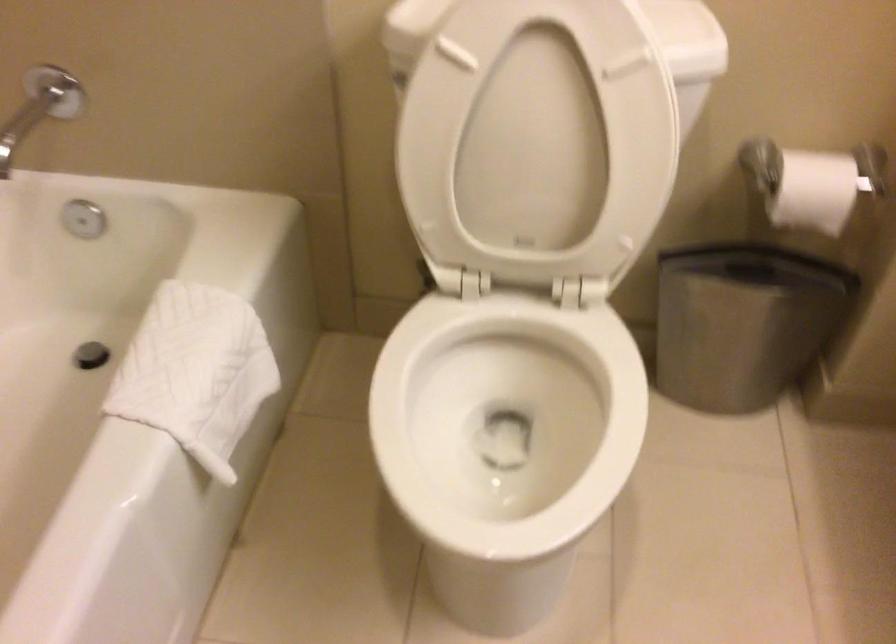
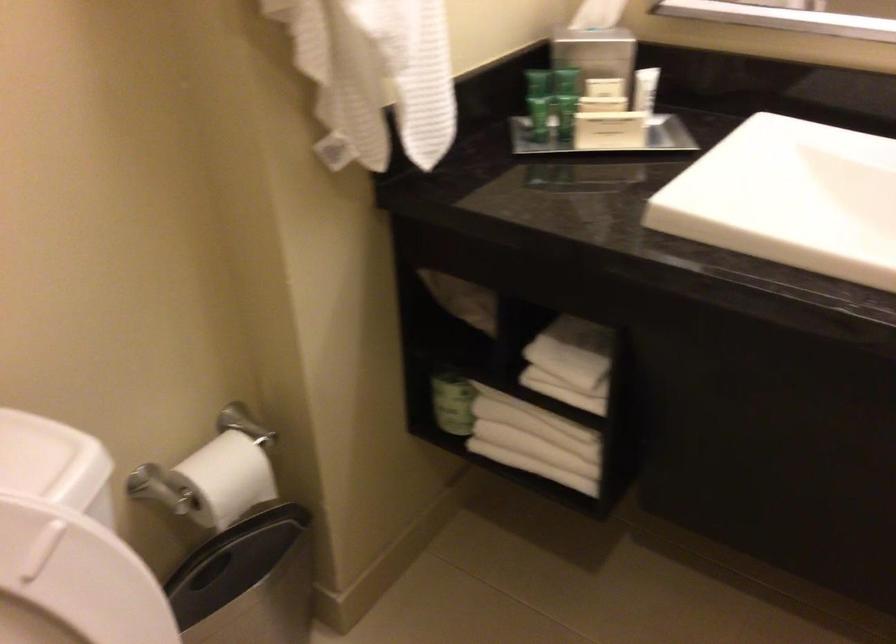
Find the pixel in the second image that matches pixel 772 306 in the first image.

(247, 582)